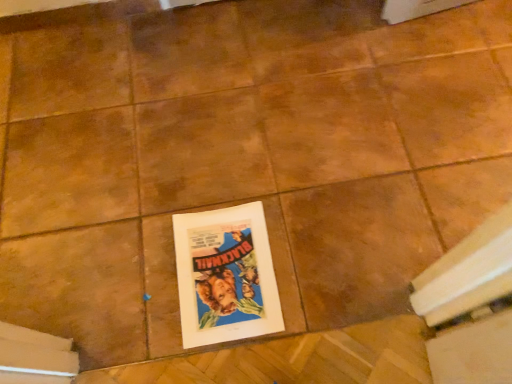
What do you see at coordinates (225, 276) in the screenshot? This screenshot has height=384, width=512. I see `matte paper poster at center` at bounding box center [225, 276].

You are a GUI agent. You are given a task and a screenshot of the screen. Output one action in this format:
    pyautogui.click(x=<x>, y=<y>)
    Task: Click on the matte paper poster at center
    The image size is (512, 384).
    Given the screenshot: What is the action you would take?
    pyautogui.click(x=225, y=276)

In order to click on matte paper poster at center in this screenshot , I will do `click(225, 276)`.